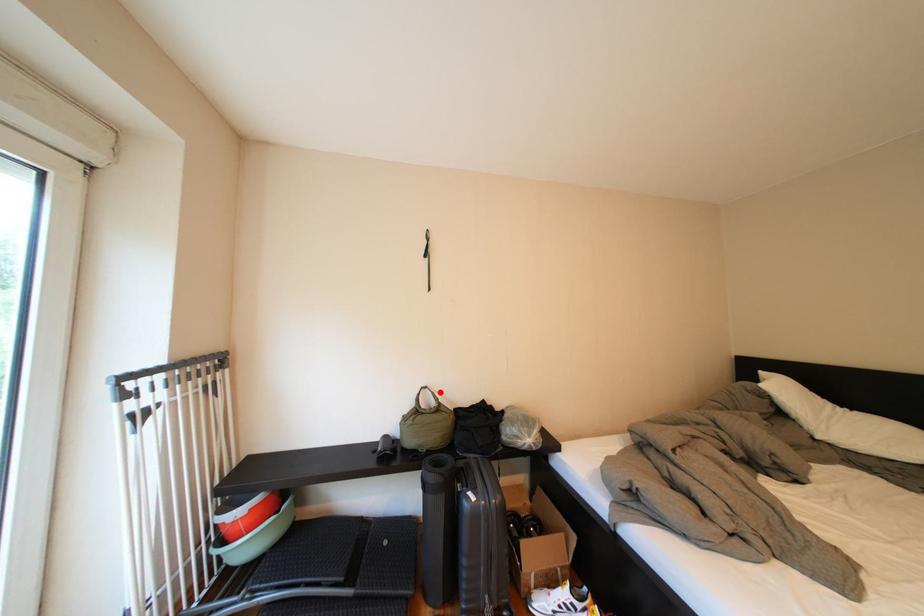
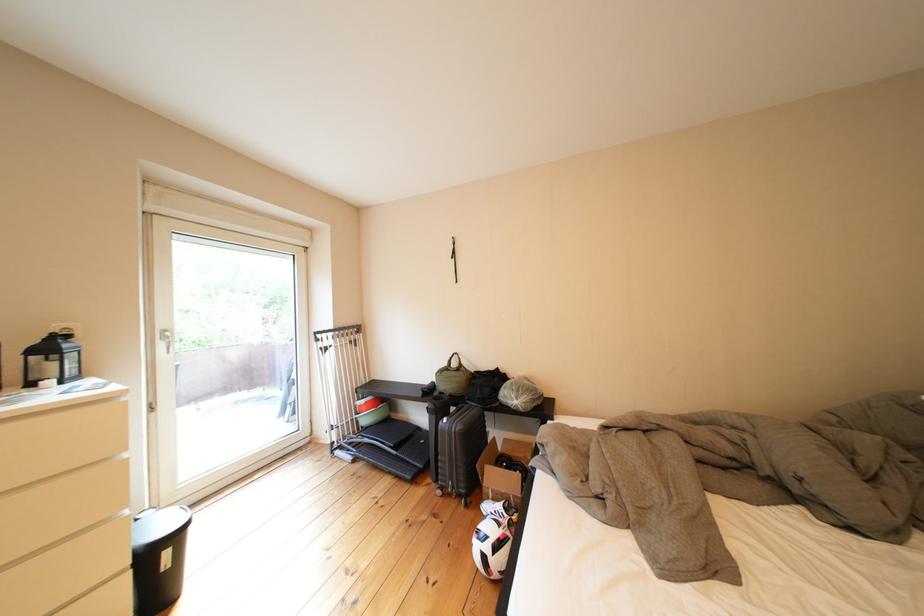
In the second image, find the point that corresponds to the highlighted location in the first image.

(469, 358)